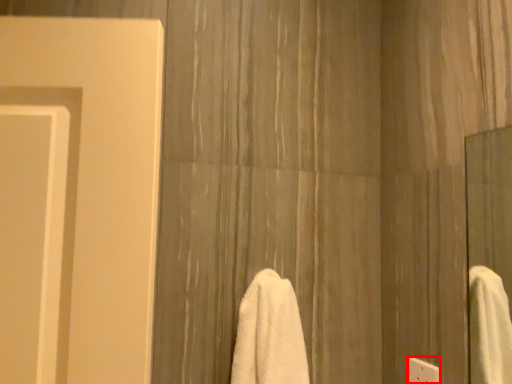
Question: Where is electric outlet (annotated by the red box) located in relation to towel in the image?

Choices:
 (A) left
 (B) right

Answer: (B)